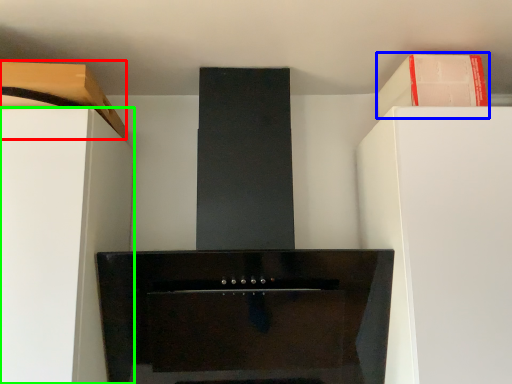
Question: Based on their relative distances, which object is farther from cabinetry (highlighted by a red box)? Choose from cabinetry (highlighted by a blue box) and furniture (highlighted by a green box).

Choices:
 (A) cabinetry
 (B) furniture

Answer: (A)